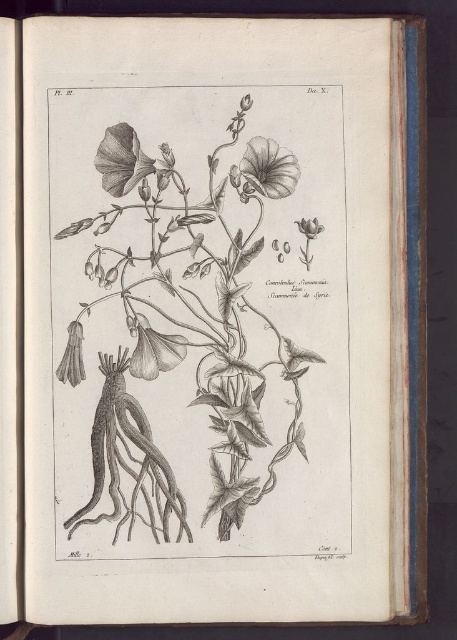
Based on the botanical illustration described, what is the significance of the point labeled at coordinates (122, 160)?

The point labeled at coordinates (122, 160) marks the location of a smooth gray petal at upper center in the botanical illustration.